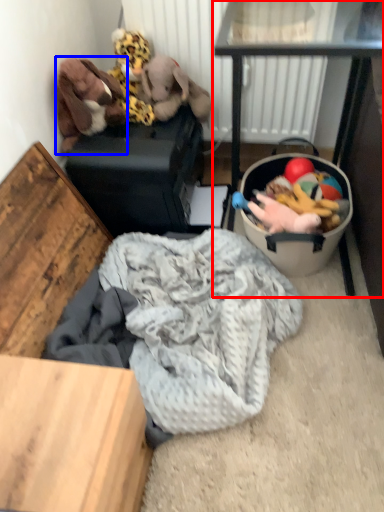
Question: Which point is closer to the camera, table (highlighted by a red box) or toy (highlighted by a blue box)?

Choices:
 (A) table
 (B) toy

Answer: (A)